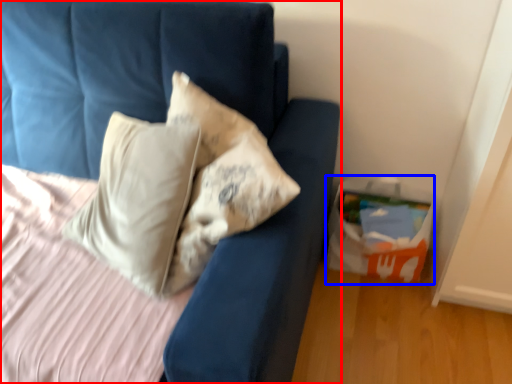
Question: Which point is closer to the camera, furniture (highlighted by a red box) or package (highlighted by a blue box)?

Choices:
 (A) furniture
 (B) package

Answer: (A)